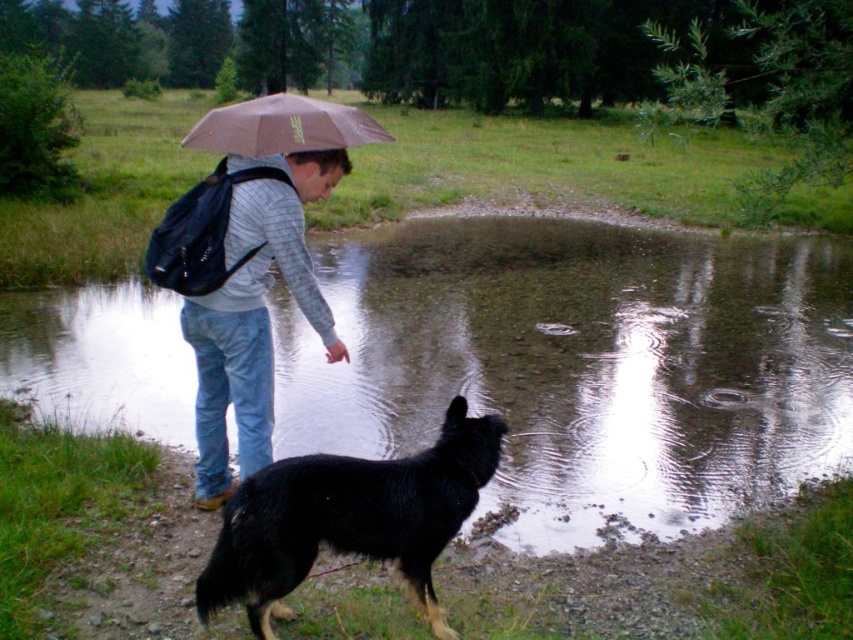
Which is above, black shaggy dog at lower center or brown matte umbrella at upper center?

brown matte umbrella at upper center is higher up.

Does point (289, 566) come closer to viewer compared to point (270, 122)?

Yes.

Between point (366, 497) and point (199, 129), which one is positioned behind?

The point (199, 129) is more distant.

At what (x,y) coordinates should I click in order to perform the action: click on black shaggy dog at lower center. Please return your answer as a coordinate pair (x, y). The height and width of the screenshot is (640, 853). Looking at the image, I should click on (347, 518).

Does point (293, 291) come farther from viewer compared to point (192, 136)?

That is False.

From the picture: Can you confirm if matte gray sweater at center is wider than brown matte umbrella at upper center?

No.

Where is `matte gray sweater at center`? The image size is (853, 640). matte gray sweater at center is located at coordinates (254, 314).

Which is in front, point (224, 509) or point (260, 376)?

Positioned in front is point (224, 509).

Is point (451, 506) farther from viewer compared to point (248, 403)?

No, (451, 506) is in front of (248, 403).

Who is more distant from viewer, (264, 509) or (283, 237)?

The point (283, 237) is behind.

At what (x,y) coordinates should I click in order to perform the action: click on black shaggy dog at lower center. Please return your answer as a coordinate pair (x, y). The width and height of the screenshot is (853, 640). Looking at the image, I should click on (347, 518).